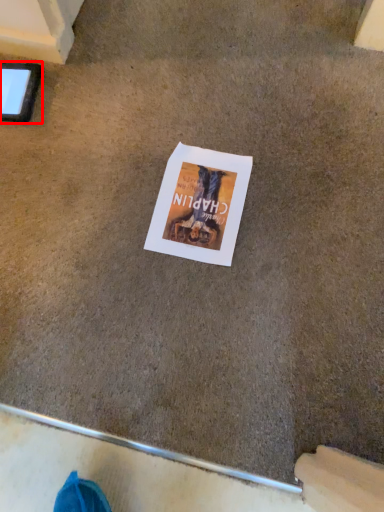
Question: From the image, what is the correct spatial relationship of tablet computer (annotated by the red box) in relation to flyer?

Choices:
 (A) right
 (B) left

Answer: (B)